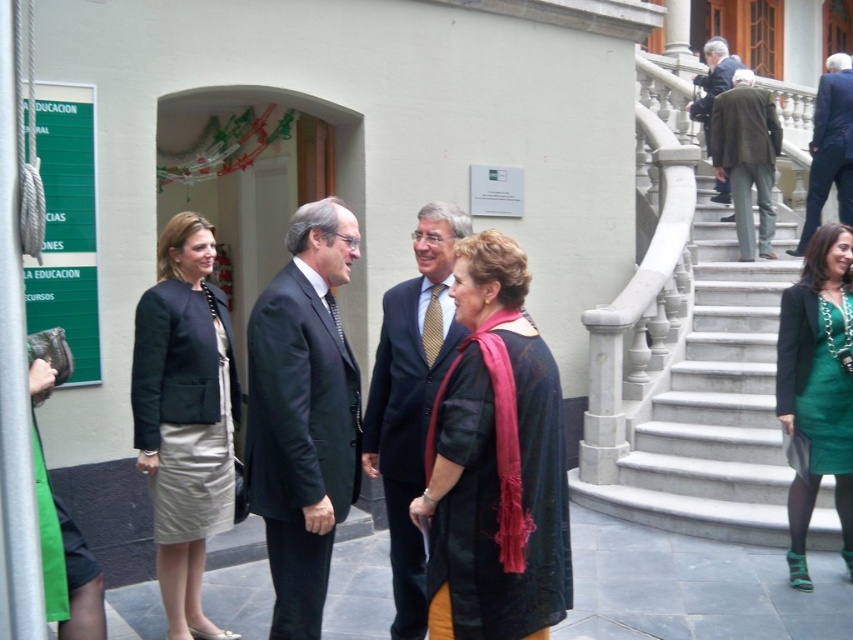
Question: Can you confirm if white marble staircase at upper right is thinner than silk beige skirt at center?

Choices:
 (A) no
 (B) yes

Answer: (A)

Question: Is dark blue suit at center thinner than blue suit at upper right?

Choices:
 (A) no
 (B) yes

Answer: (B)

Question: Which is farther from the dark gray suit at center?

Choices:
 (A) white marble staircase at upper right
 (B) green wool coat at upper right

Answer: (B)

Question: Which point appears closest to the camera in this image?

Choices:
 (A) (691, 113)
 (B) (553, 486)
 (C) (310, 257)
 (D) (436, 378)

Answer: (B)

Question: Which point appears closest to the camera in this image?

Choices:
 (A) (340, 268)
 (B) (837, 131)
 (C) (509, 589)
 (D) (666, 513)

Answer: (C)

Question: Is velvet black shawl at center wider than blue suit at upper right?

Choices:
 (A) yes
 (B) no

Answer: (B)